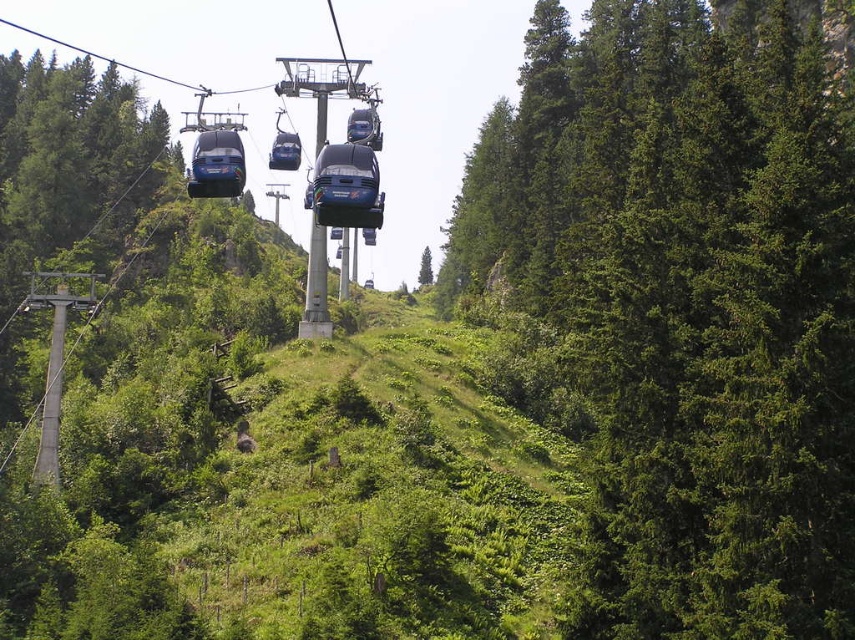
Question: Is blue metallic cable car at center further to the viewer compared to green matte tree at center?

Choices:
 (A) yes
 (B) no

Answer: (B)

Question: Is blue metallic cable car at center further to the viewer compared to matte blue cable car at upper center?

Choices:
 (A) no
 (B) yes

Answer: (A)

Question: Among these points, which one is farthest from the camera?

Choices:
 (A) (335, 202)
 (B) (193, 150)
 (C) (426, 260)

Answer: (C)

Question: Does metallic blue cable car at center have a larger size compared to green matte tree at center?

Choices:
 (A) yes
 (B) no

Answer: (B)

Question: Which of these objects is positioned farthest from the matte blue cable car at upper center?

Choices:
 (A) green matte tree at center
 (B) blue metallic cable car at center
 (C) metallic blue cable car at center

Answer: (A)

Question: Among these objects, which one is farthest from the camera?

Choices:
 (A) green matte tree at center
 (B) green matte tree at right
 (C) matte blue cable car at upper center
 (D) metallic blue cable car at center

Answer: (A)